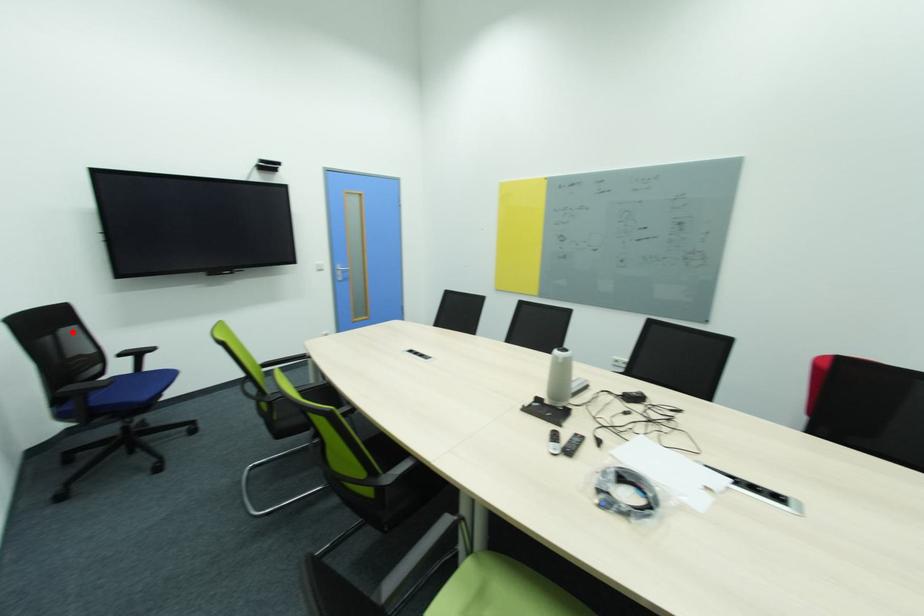
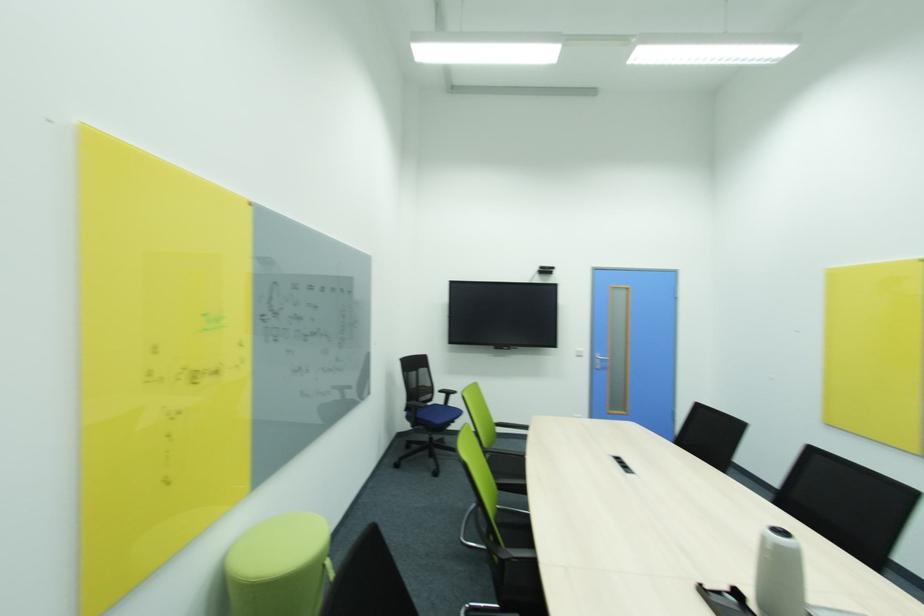
Locate, in the second image, the point that corresponds to the highlighted location in the first image.

(428, 371)